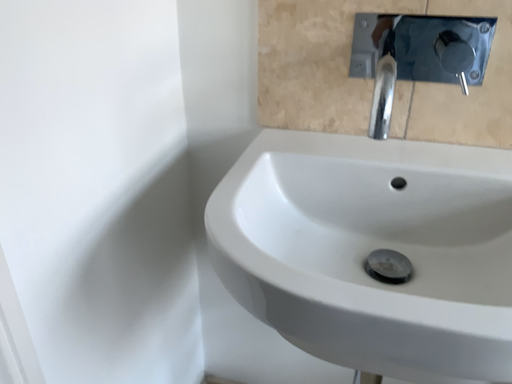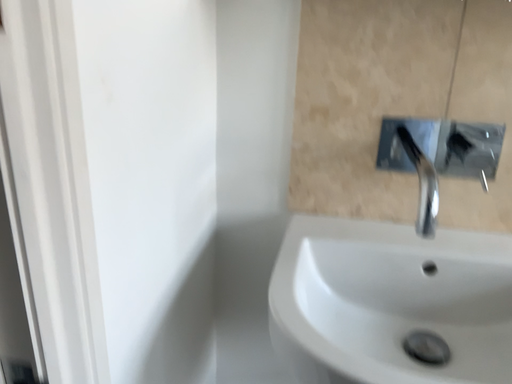
Question: Which way did the camera rotate in the video?

Choices:
 (A) rotated upward
 (B) rotated downward

Answer: (A)